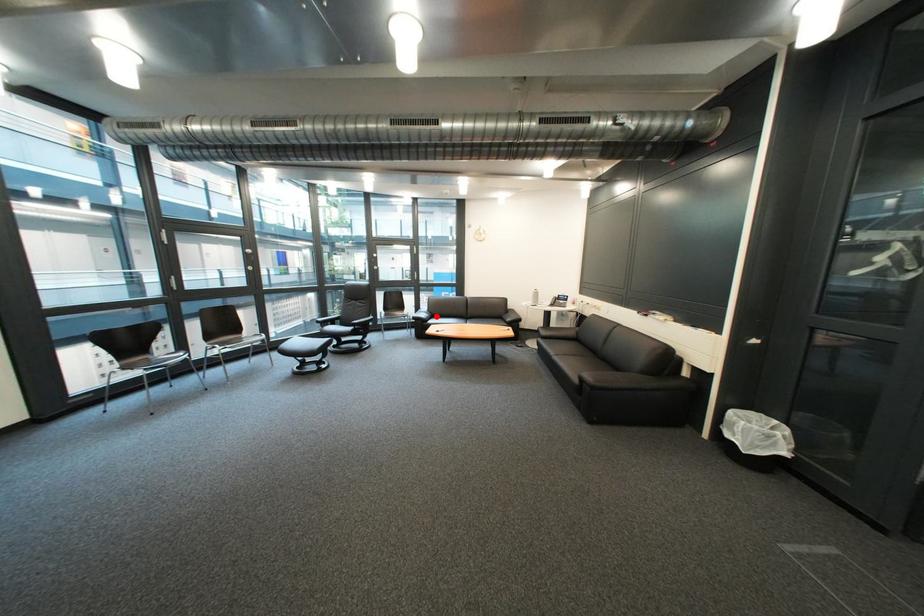
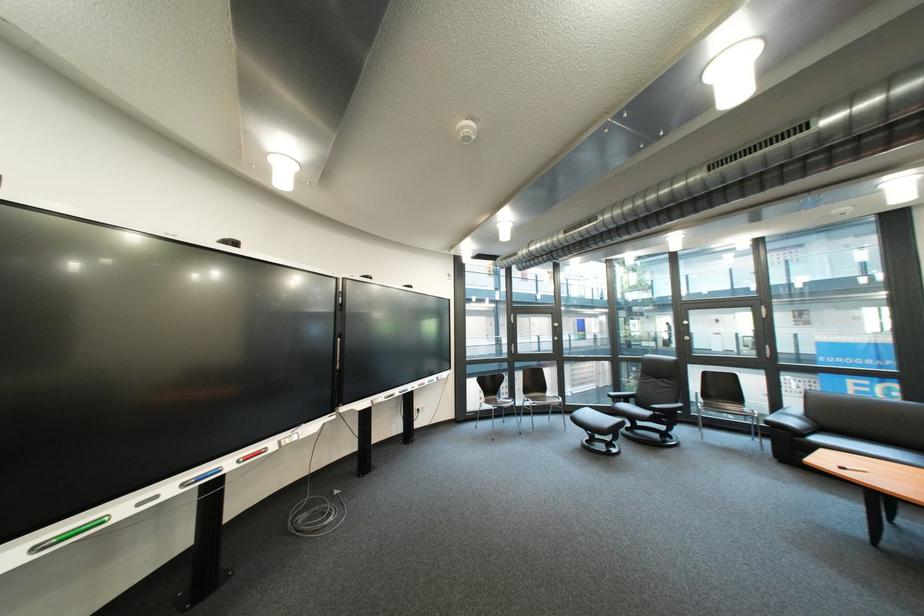
Question: I am providing you with two images of the same scene from different viewpoints. In image1, a red point is highlighted. Considering the same 3D point in image2, which of the following is correct?

Choices:
 (A) It is closer
 (B) It is farther

Answer: (A)